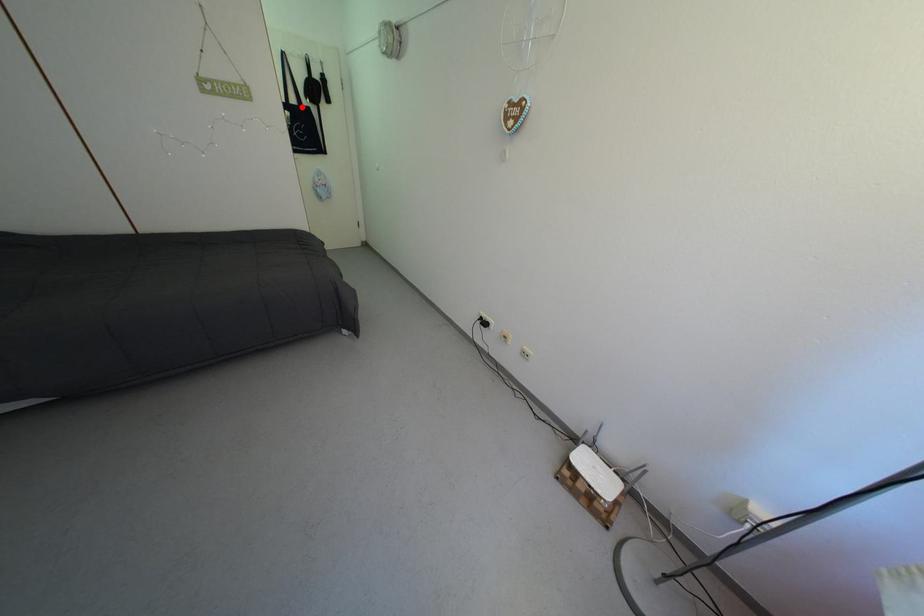
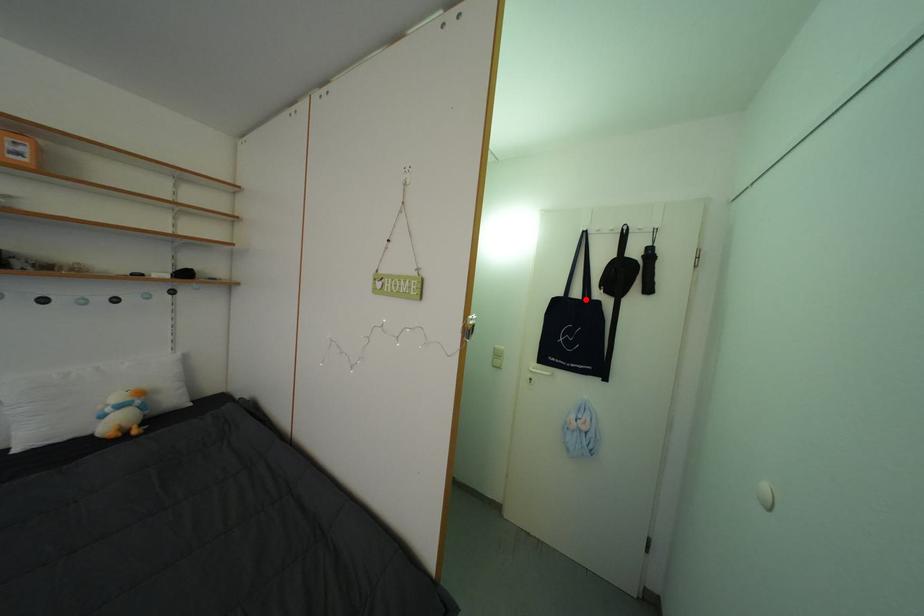
I am providing you with two images of the same scene from different viewpoints. A red point is marked on the first image and another point is marked on the second image. Do the highlighted points in image1 and image2 indicate the same real-world spot?

Yes